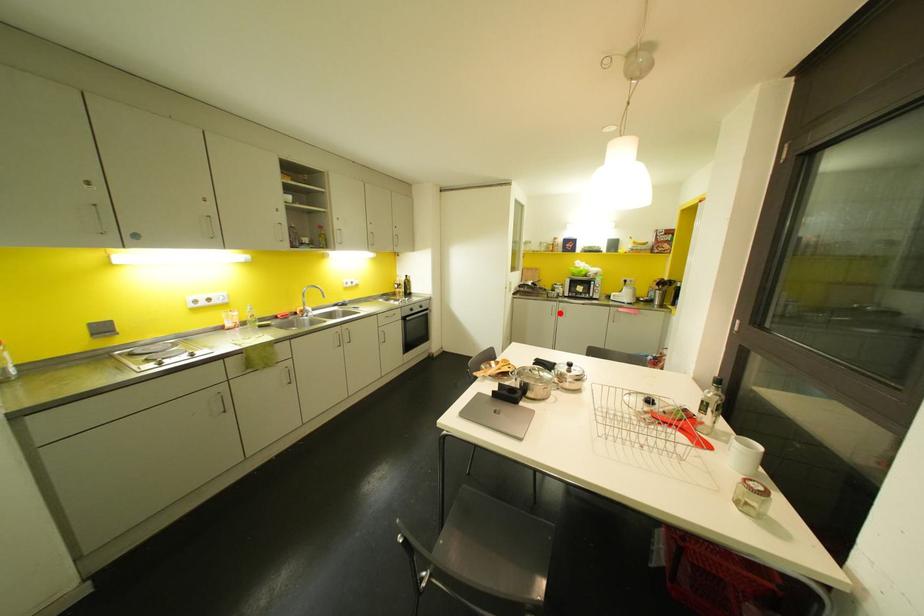
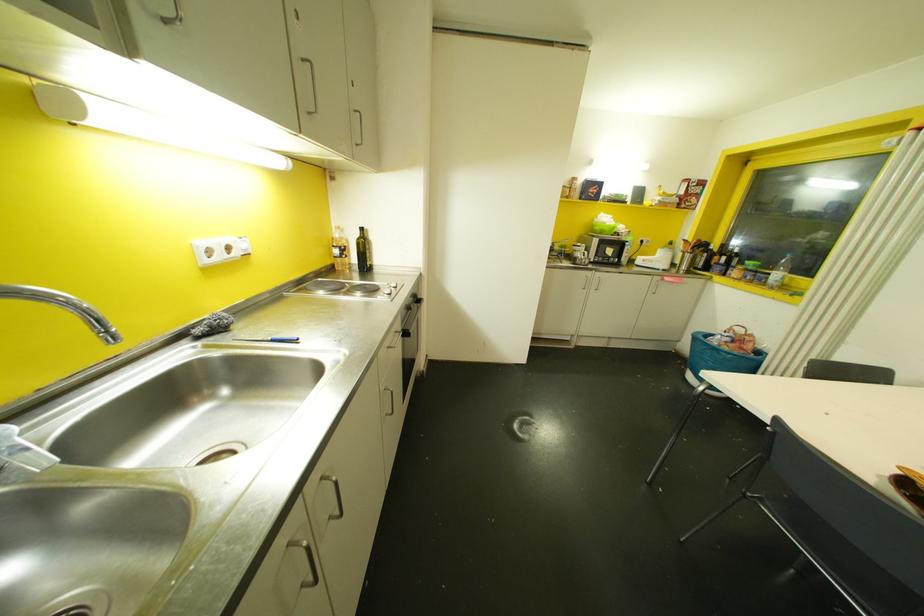
Question: A red point is marked in image1. In image2, is the corresponding 3D point closer to the camera or farther? Reply with the corresponding letter.

Choices:
 (A) The corresponding 3D point is closer.
 (B) The corresponding 3D point is farther.

Answer: (A)